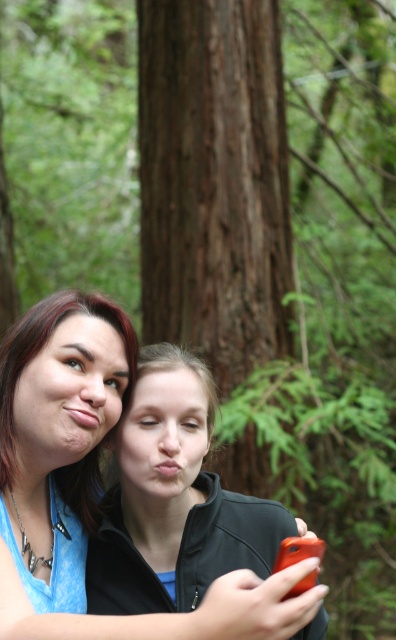
You are a photographer trying to capture a candid shot of the two people in the forest scene. You notice both the matte blue shirt at lower left and the matte blue shirt at left. Which one is located lower in the frame?

The matte blue shirt at lower left is positioned under the matte blue shirt at left, so it is located lower in the frame.

You are a photographer trying to capture a photo of the brown rough tree trunk at center and the matte blue shirt at left. Which object should you focus on first if you want to ensure both are in sharp focus?

The brown rough tree trunk at center is above the matte blue shirt at left, so focusing on the matte blue shirt at left first will help ensure both are in sharp focus since it is closer to the camera.

You are trying to identify the exact location of two people wearing matte blue shirts in a forest scene. According to the image, which of the two, the matte blue shirt at lower left or the matte blue shirt at left, is positioned to the right of the other?

The matte blue shirt at lower left is positioned on the right side of matte blue shirt at left.